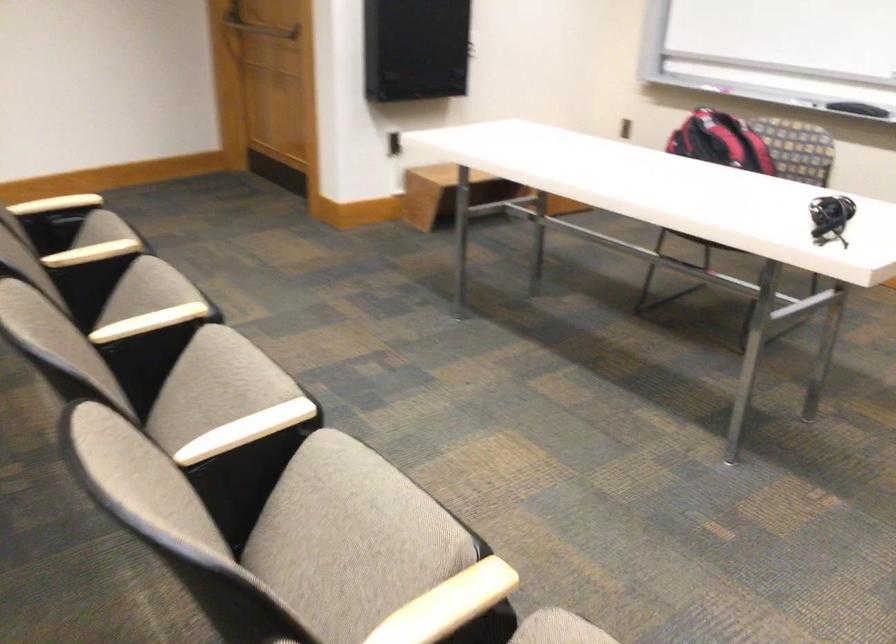
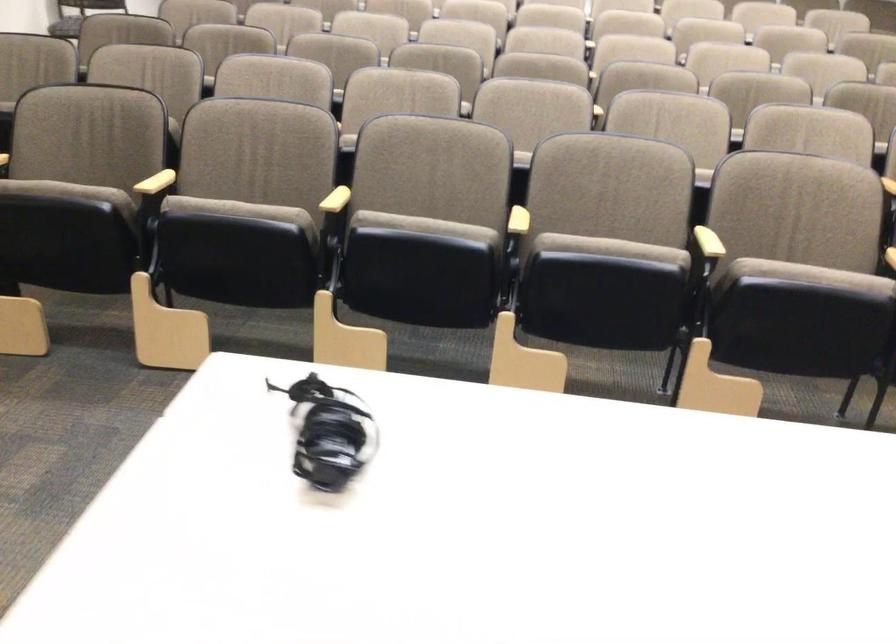
Locate, in the second image, the point that corresponds to pixel 144 321 in the first image.

(709, 242)